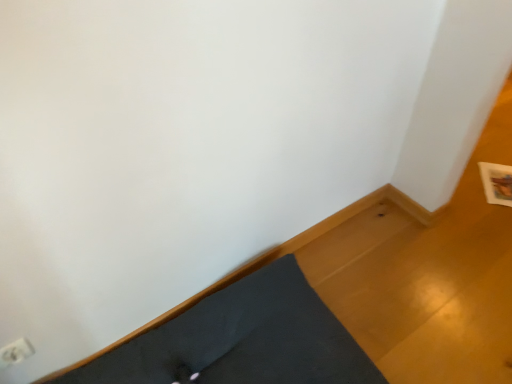
Question: Is dark gray fabric bed frame at lower left inside white plastic electric outlet at lower left?

Choices:
 (A) no
 (B) yes

Answer: (A)

Question: Can you see white plastic electric outlet at lower left touching dark gray fabric bed frame at lower left?

Choices:
 (A) yes
 (B) no

Answer: (B)

Question: Considering the relative positions of white plastic electric outlet at lower left and dark gray fabric bed frame at lower left in the image provided, is white plastic electric outlet at lower left in front of dark gray fabric bed frame at lower left?

Choices:
 (A) no
 (B) yes

Answer: (A)

Question: From a real-world perspective, is white plastic electric outlet at lower left below dark gray fabric bed frame at lower left?

Choices:
 (A) no
 (B) yes

Answer: (A)

Question: Can you confirm if white plastic electric outlet at lower left is thinner than dark gray fabric bed frame at lower left?

Choices:
 (A) no
 (B) yes

Answer: (B)

Question: Can you confirm if white plastic electric outlet at lower left is bigger than dark gray fabric bed frame at lower left?

Choices:
 (A) no
 (B) yes

Answer: (A)

Question: Can you confirm if dark gray fabric bed frame at lower left is taller than white plastic electric outlet at lower left?

Choices:
 (A) no
 (B) yes

Answer: (B)

Question: Can you confirm if dark gray fabric bed frame at lower left is shorter than white plastic electric outlet at lower left?

Choices:
 (A) no
 (B) yes

Answer: (A)

Question: Does dark gray fabric bed frame at lower left have a larger size compared to white plastic electric outlet at lower left?

Choices:
 (A) yes
 (B) no

Answer: (A)

Question: Is dark gray fabric bed frame at lower left at the right side of white plastic electric outlet at lower left?

Choices:
 (A) yes
 (B) no

Answer: (A)

Question: From the image's perspective, is dark gray fabric bed frame at lower left over white plastic electric outlet at lower left?

Choices:
 (A) yes
 (B) no

Answer: (B)

Question: Is dark gray fabric bed frame at lower left oriented away from white plastic electric outlet at lower left?

Choices:
 (A) no
 (B) yes

Answer: (A)

Question: From a real-world perspective, is dark gray fabric bed frame at lower left physically located above or below white plastic electric outlet at lower left?

Choices:
 (A) below
 (B) above

Answer: (A)